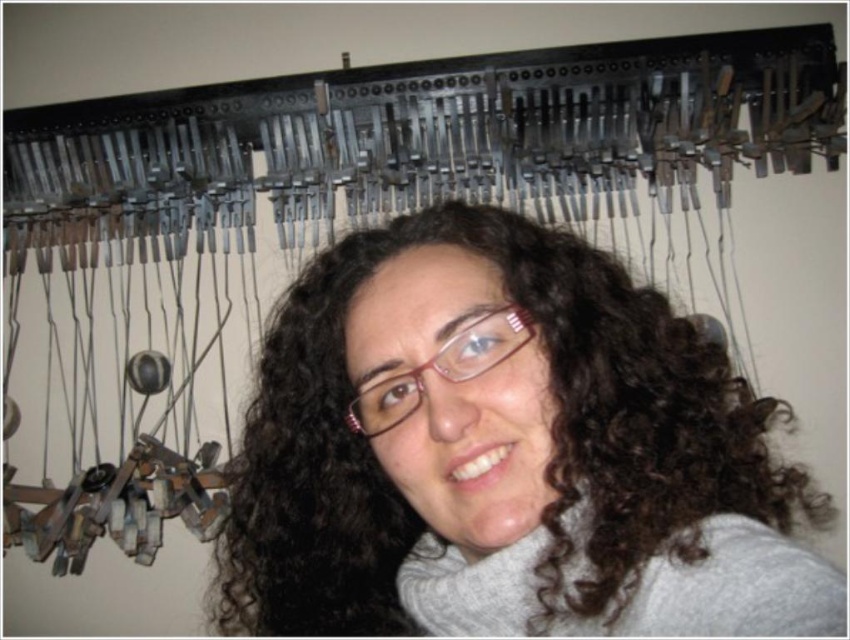
You are a photographer trying to capture a closeup of the person in the scene. You want to ensure that both the dark brown curly hair at center and the pink plastic glasses at center are clearly visible in the photo. Given their sizes, which object should you focus on first to ensure both are in focus?

The dark brown curly hair at center is bigger than the pink plastic glasses at center, so focusing on the larger object first will help ensure both are in focus.

You are a photographer trying to capture a closeup of the person in the image. You need to ensure that both the dark brown curly hair at center and the pink plastic glasses at center are clearly visible in the frame. Given that your camera has a fixed focal length, which object should you prioritize framing first to ensure both are in focus?

Since the dark brown curly hair at center has a larger width than the pink plastic glasses at center, you should prioritize framing the dark brown curly hair at center first. This ensures that the wider object is within the depth of field, making both objects clearly visible.

You are a photographer trying to capture a portrait of the person in the scene. The dark brown curly hair at center and the pink plastic glasses at center are both in focus. If you want to adjust the camera so that only one of them is in focus, which object should you focus on to ensure it remains sharp while the other becomes blurry?

The dark brown curly hair at center is much taller than the pink plastic glasses at center. To keep one in focus while blurring the other, focus on the pink plastic glasses at center since it is closer to the camera. However, depth of field considerations would require adjusting the aperture or focal plane accordingly.